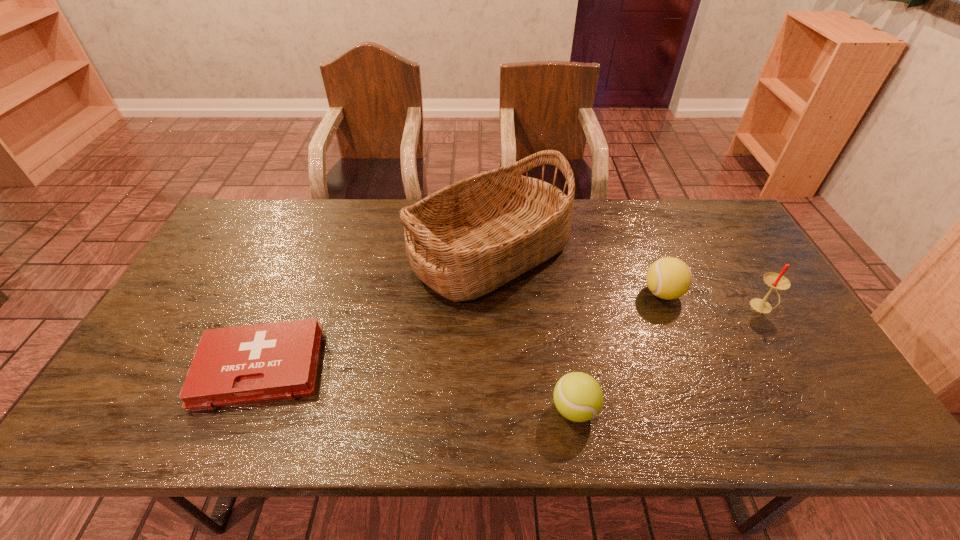
Image resolution: width=960 pixels, height=540 pixels. What are the coordinates of `the tallest object` in the screenshot? It's located at (464, 241).

This screenshot has height=540, width=960. I want to click on candle, so click(x=776, y=281).

I want to click on the rightmost object, so click(776, 281).

You are a GUI agent. You are given a task and a screenshot of the screen. Output one action in this format:
    pyautogui.click(x=<x>, y=<y>)
    Task: Click on the right tennis ball
    The image size is (960, 540).
    Given the screenshot: What is the action you would take?
    pyautogui.click(x=669, y=278)

The width and height of the screenshot is (960, 540). What are the coordinates of `the farther tennis ball` in the screenshot? It's located at (669, 278).

Find the location of a particular element. Image resolution: width=960 pixels, height=540 pixels. the left tennis ball is located at coordinates (578, 397).

Where is `the first-aid kit`? This screenshot has width=960, height=540. the first-aid kit is located at coordinates (248, 364).

Locate an element on the screen. The image size is (960, 540). the shortest object is located at coordinates (248, 364).

At what (x,y) coordinates should I click in order to perform the action: click on free space located 0.060m on the right of the basket. Please return your answer as a coordinate pair (x, y). Looking at the image, I should click on (589, 253).

This screenshot has height=540, width=960. In order to click on free region located on the front of the candle in this screenshot , I will do `click(783, 343)`.